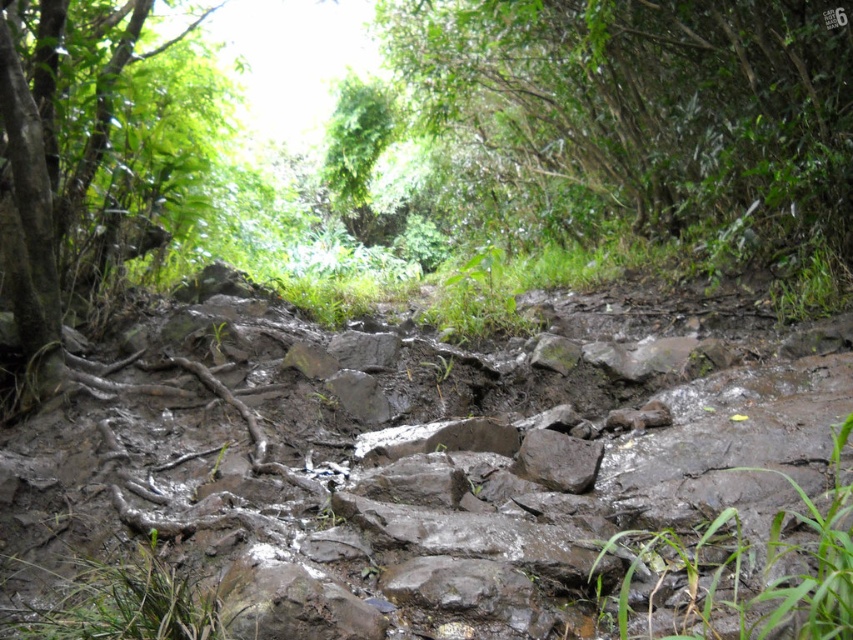
Is green leafy tree at upper center closer to the viewer compared to brown rough tree roots at left?

No, green leafy tree at upper center is further to the viewer.

Who is shorter, green leafy tree at upper center or brown rough tree roots at left?

Standing shorter between the two is brown rough tree roots at left.

Does point (759, 257) come closer to viewer compared to point (22, 292)?

No, it is behind (22, 292).

Where is `green leafy tree at upper center`? green leafy tree at upper center is located at coordinates 637,116.